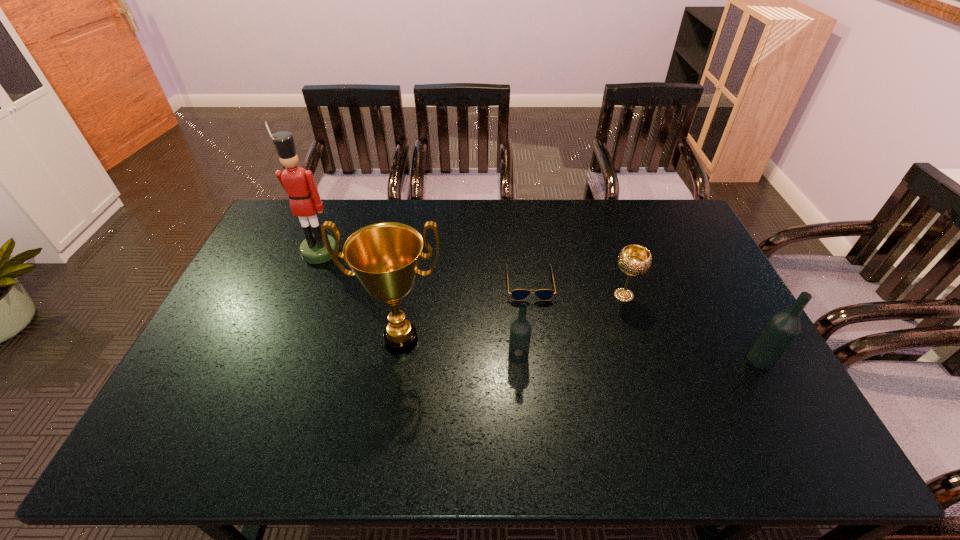
Image resolution: width=960 pixels, height=540 pixels. What are the coordinates of `vacant area at the far right corner of the desktop` in the screenshot? It's located at point(651,235).

Locate an element on the screen. free space between the rightmost object and the nutcracker is located at coordinates (540, 306).

Locate an element on the screen. The image size is (960, 540). free space that is in between the second object from right to left and the sunglasses is located at coordinates (577, 289).

The image size is (960, 540). I want to click on empty location between the right vodka and the fifth object from right to left, so click(581, 349).

The width and height of the screenshot is (960, 540). Find the location of `unoccupied area between the taller vodka and the award`. unoccupied area between the taller vodka and the award is located at coordinates (581, 349).

Find the location of a particular element. Image resolution: width=960 pixels, height=540 pixels. vacant area that lies between the leftmost object and the chalice is located at coordinates (471, 274).

Locate an element on the screen. The height and width of the screenshot is (540, 960). vacant region between the leftmost object and the taller vodka is located at coordinates (540, 306).

The height and width of the screenshot is (540, 960). Find the location of `free space between the right vodka and the farthest object`. free space between the right vodka and the farthest object is located at coordinates (540, 306).

This screenshot has height=540, width=960. Find the location of `free space between the right vodka and the chalice`. free space between the right vodka and the chalice is located at coordinates (692, 327).

Image resolution: width=960 pixels, height=540 pixels. I want to click on vacant space that is in between the second object from left to right and the right vodka, so click(581, 349).